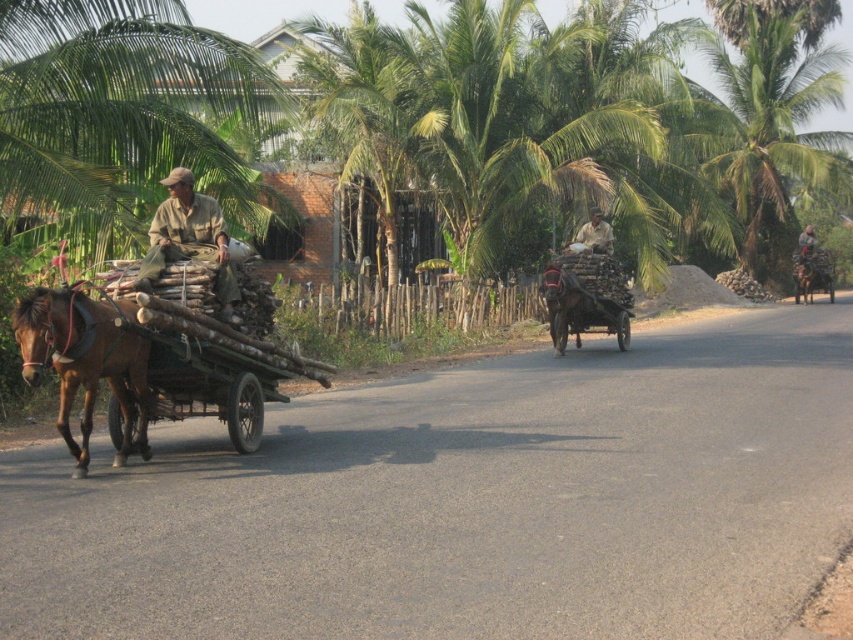
Question: From the image, what is the correct spatial relationship of green leafy coconut tree at upper right in relation to khaki cotton shirt at center?

Choices:
 (A) above
 (B) below

Answer: (A)

Question: Among these points, which one is farthest from the camera?

Choices:
 (A) (68, 406)
 (B) (595, 208)
 (C) (753, 138)
 (D) (618, 344)

Answer: (C)

Question: Which of the following is the farthest from the observer?

Choices:
 (A) (126, 397)
 (B) (808, 29)
 (C) (602, 224)

Answer: (B)

Question: Is green leafy coconut tree at upper right above brown glossy horse at left?

Choices:
 (A) no
 (B) yes

Answer: (B)

Question: Which point appears farthest from the camera in this image?

Choices:
 (A) (770, 264)
 (B) (596, 321)

Answer: (A)

Question: Observing the image, what is the correct spatial positioning of brown glossy horse at left in reference to wooden cart at center?

Choices:
 (A) above
 (B) below

Answer: (B)